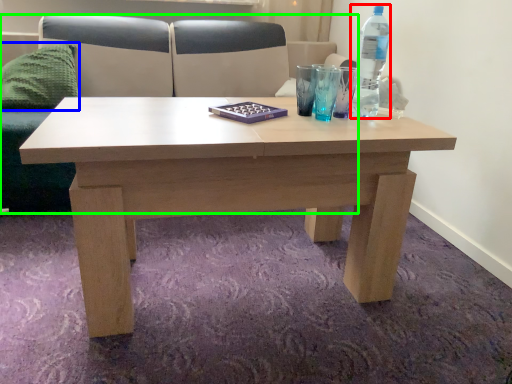
Question: Based on their relative distances, which object is farther from bottle (highlighted by a red box)? Choose from pillow (highlighted by a blue box) and couch (highlighted by a green box).

Choices:
 (A) pillow
 (B) couch

Answer: (A)